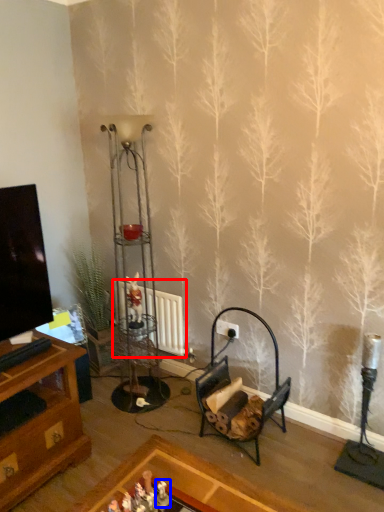
Question: Which object is further to the camera taking this photo, radiator (highlighted by a red box) or toy (highlighted by a blue box)?

Choices:
 (A) radiator
 (B) toy

Answer: (A)